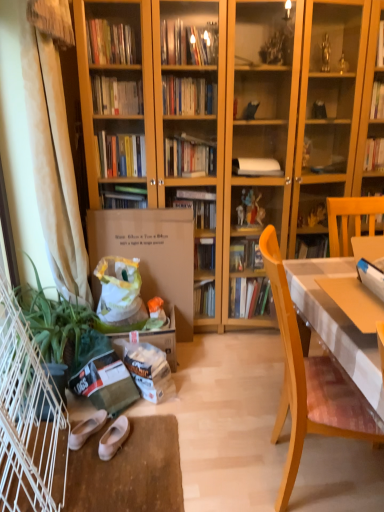
Question: Should I look upward or downward to see white fabric curtain at left?

Choices:
 (A) down
 (B) up

Answer: (B)

Question: From a real-world perspective, does wooden chair at right sit lower than white leather shoes at lower center, which is the 2th footwear in left-to-right order?

Choices:
 (A) no
 (B) yes

Answer: (A)

Question: Could you tell me if wooden chair at right is turned towards white leather shoes at lower center, which is the 2th footwear in left-to-right order?

Choices:
 (A) no
 (B) yes

Answer: (A)

Question: Can you see wooden chair at right touching white leather shoes at lower center, which is the 2th footwear in left-to-right order?

Choices:
 (A) yes
 (B) no

Answer: (B)

Question: Is white leather shoes at lower center, which is the 2th footwear in left-to-right order, a part of wooden chair at right?

Choices:
 (A) yes
 (B) no

Answer: (B)

Question: Is wooden chair at right positioned beyond the bounds of white leather shoes at lower center, which is the 2th footwear in left-to-right order?

Choices:
 (A) yes
 (B) no

Answer: (A)

Question: Is wooden chair at right to the right of white leather shoes at lower center, which is the 2th footwear in left-to-right order, from the viewer's perspective?

Choices:
 (A) no
 (B) yes

Answer: (B)

Question: Could you tell me if white leather shoes at lower center, which is the 2th footwear in left-to-right order, is turned towards black plastic flowerpot at lower left?

Choices:
 (A) yes
 (B) no

Answer: (B)

Question: Is white leather shoes at lower center, acting as the first footwear starting from the right, oriented away from black plastic flowerpot at lower left?

Choices:
 (A) no
 (B) yes

Answer: (A)

Question: Is white leather shoes at lower center, acting as the first footwear starting from the right, closer to the viewer compared to black plastic flowerpot at lower left?

Choices:
 (A) no
 (B) yes

Answer: (B)

Question: Is white leather shoes at lower center, which is the 2th footwear in left-to-right order, positioned beyond the bounds of black plastic flowerpot at lower left?

Choices:
 (A) no
 (B) yes

Answer: (B)

Question: Does white leather shoes at lower center, acting as the first footwear starting from the right, lie behind black plastic flowerpot at lower left?

Choices:
 (A) no
 (B) yes

Answer: (A)

Question: Is white leather shoes at lower center, which is the 2th footwear in left-to-right order, with black plastic flowerpot at lower left?

Choices:
 (A) no
 (B) yes

Answer: (A)

Question: Is green leafy plant at lower left outside white cloth-covered desk at right?

Choices:
 (A) yes
 (B) no

Answer: (A)